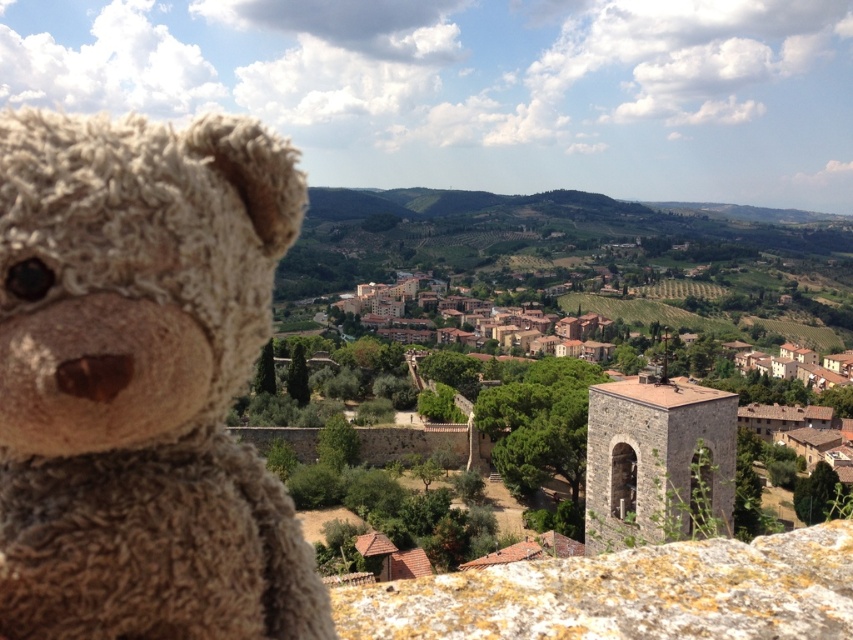
Question: Does fuzzy beige teddy bear at left come in front of rusty stone wall at lower center?

Choices:
 (A) no
 (B) yes

Answer: (B)

Question: Does fuzzy beige teddy bear at left appear under rusty stone wall at lower center?

Choices:
 (A) yes
 (B) no

Answer: (B)

Question: Can you confirm if fuzzy beige teddy bear at left is thinner than rusty stone wall at lower center?

Choices:
 (A) yes
 (B) no

Answer: (A)

Question: Among these points, which one is farthest from the camera?

Choices:
 (A) (645, 611)
 (B) (202, 292)

Answer: (A)

Question: Which of the following is the closest to the observer?

Choices:
 (A) (76, 586)
 (B) (374, 636)

Answer: (A)